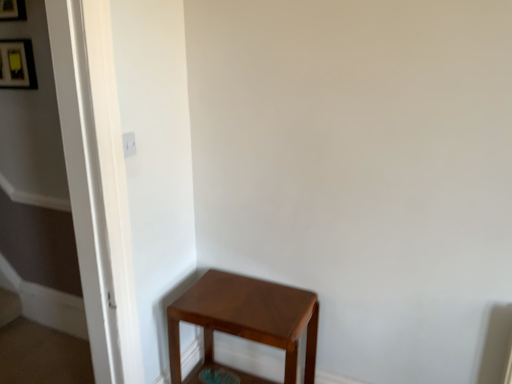
Question: Should I look upward or downward to see matte brown stool at lower right?

Choices:
 (A) up
 (B) down

Answer: (B)

Question: Is matte black picture frame at upper left, marked as the first picture frame in a bottom-to-top arrangement, not within matte brown stool at lower right?

Choices:
 (A) yes
 (B) no

Answer: (A)

Question: Could you tell me if matte black picture frame at upper left, marked as the first picture frame in a bottom-to-top arrangement, is turned towards matte brown stool at lower right?

Choices:
 (A) yes
 (B) no

Answer: (B)

Question: Is matte black picture frame at upper left, arranged as the 2th picture frame when viewed from the top, wider than matte brown stool at lower right?

Choices:
 (A) yes
 (B) no

Answer: (B)

Question: Considering the relative sizes of matte black picture frame at upper left, marked as the first picture frame in a bottom-to-top arrangement, and matte brown stool at lower right in the image provided, is matte black picture frame at upper left, marked as the first picture frame in a bottom-to-top arrangement, thinner than matte brown stool at lower right?

Choices:
 (A) no
 (B) yes

Answer: (B)

Question: Can you confirm if matte black picture frame at upper left, marked as the first picture frame in a bottom-to-top arrangement, is shorter than matte brown stool at lower right?

Choices:
 (A) yes
 (B) no

Answer: (A)

Question: Could you tell me if matte black picture frame at upper left, positioned as the 2th picture frame in bottom-to-top order, is turned towards matte black picture frame at upper left, arranged as the 2th picture frame when viewed from the top?

Choices:
 (A) no
 (B) yes

Answer: (A)

Question: Can you confirm if matte black picture frame at upper left, positioned as the 2th picture frame in bottom-to-top order, is bigger than matte black picture frame at upper left, arranged as the 2th picture frame when viewed from the top?

Choices:
 (A) yes
 (B) no

Answer: (A)

Question: Is matte black picture frame at upper left, positioned as the 2th picture frame in bottom-to-top order, wider than matte black picture frame at upper left, marked as the first picture frame in a bottom-to-top arrangement?

Choices:
 (A) yes
 (B) no

Answer: (A)

Question: From the image's perspective, does matte black picture frame at upper left, the first picture frame positioned from the top, appear lower than matte black picture frame at upper left, arranged as the 2th picture frame when viewed from the top?

Choices:
 (A) no
 (B) yes

Answer: (A)

Question: From a real-world perspective, is matte black picture frame at upper left, positioned as the 2th picture frame in bottom-to-top order, physically above matte black picture frame at upper left, marked as the first picture frame in a bottom-to-top arrangement?

Choices:
 (A) no
 (B) yes

Answer: (B)

Question: Does matte black picture frame at upper left, the first picture frame positioned from the top, have a greater height compared to matte black picture frame at upper left, marked as the first picture frame in a bottom-to-top arrangement?

Choices:
 (A) no
 (B) yes

Answer: (B)

Question: Is matte black picture frame at upper left, marked as the first picture frame in a bottom-to-top arrangement, shorter than matte black picture frame at upper left, positioned as the 2th picture frame in bottom-to-top order?

Choices:
 (A) no
 (B) yes

Answer: (B)